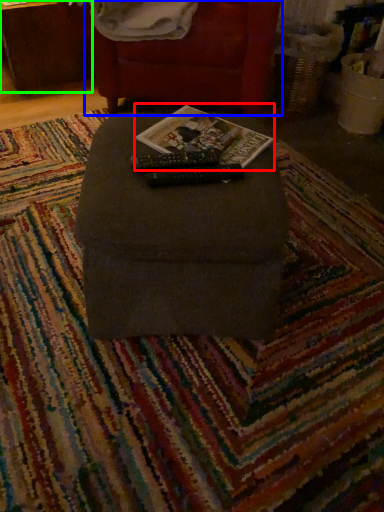
Question: Which is nearer to the magazine (highlighted by a red box)? furniture (highlighted by a blue box) or table (highlighted by a green box).

Choices:
 (A) furniture
 (B) table

Answer: (A)